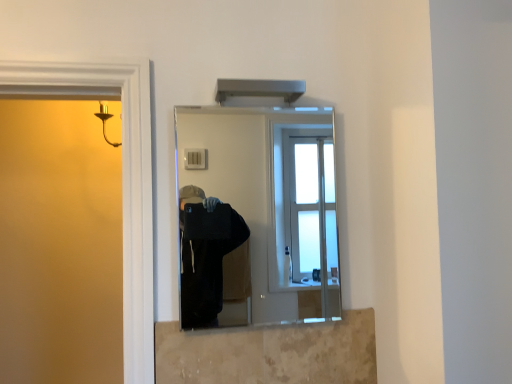
Where is `clear glass mirror at upper center`? clear glass mirror at upper center is located at coordinates (263, 212).

Describe the element at coordinates (263, 212) in the screenshot. I see `clear glass mirror at upper center` at that location.

You are a GUI agent. You are given a task and a screenshot of the screen. Output one action in this format:
    pyautogui.click(x=<x>, y=<y>)
    Task: Click on the clear glass mirror at upper center
    The width and height of the screenshot is (512, 384).
    Given the screenshot: What is the action you would take?
    pyautogui.click(x=263, y=212)